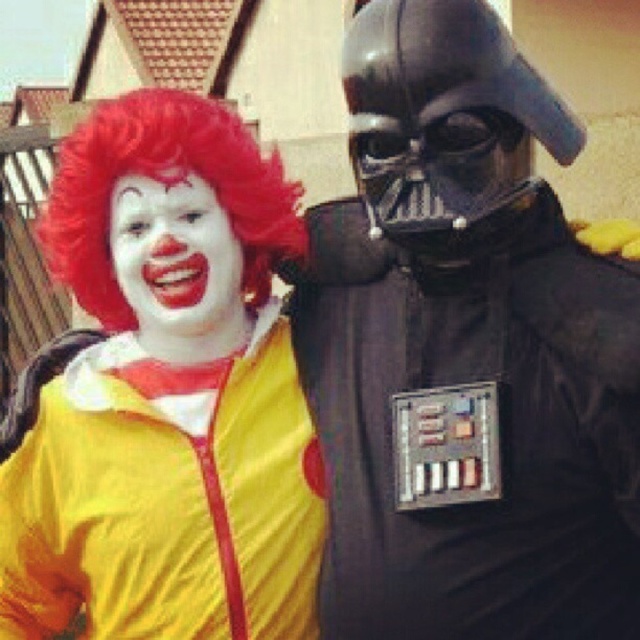
Image resolution: width=640 pixels, height=640 pixels. What do you see at coordinates (499, 424) in the screenshot?
I see `black matte armor at center` at bounding box center [499, 424].

Is point (477, 556) more distant than point (148, 93)?

No, it is not.

Does point (401, 266) come behind point (140, 173)?

Yes, it is behind point (140, 173).

At what (x,y) coordinates should I click in order to perform the action: click on black matte armor at center. Please return your answer as a coordinate pair (x, y). The image size is (640, 640). Looking at the image, I should click on point(499,424).

The height and width of the screenshot is (640, 640). Find the location of `yellow matte clown costume at left`. yellow matte clown costume at left is located at coordinates (164, 394).

This screenshot has width=640, height=640. What do you see at coordinates (164, 394) in the screenshot?
I see `yellow matte clown costume at left` at bounding box center [164, 394].

You are a GUI agent. You are given a task and a screenshot of the screen. Output one action in this format:
    pyautogui.click(x=<x>, y=<y>)
    Task: Click on the yellow matte clown costume at left
    
    Given the screenshot: What is the action you would take?
    pyautogui.click(x=164, y=394)

Does yellow matte clown costume at left have a greater width compared to red synthetic wig at left?

Yes.

Which is more to the right, yellow matte clown costume at left or red synthetic wig at left?

red synthetic wig at left

Is point (77, 445) closer to camera compared to point (100, 176)?

No, (77, 445) is further to viewer.

Where is `yellow matte clown costume at left`? yellow matte clown costume at left is located at coordinates (164, 394).